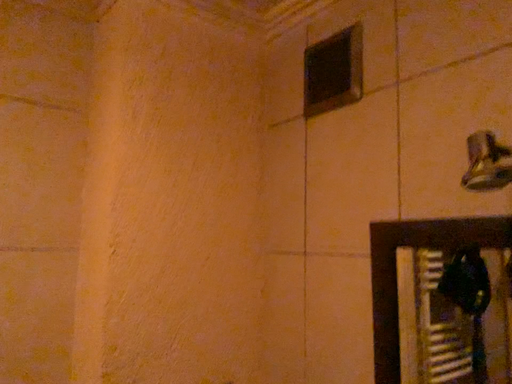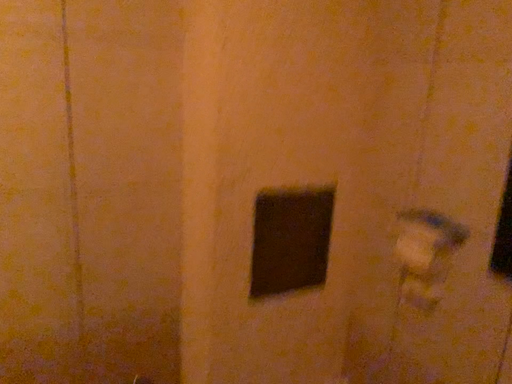
Question: How did the camera likely rotate when shooting the video?

Choices:
 (A) rotated downward
 (B) rotated upward

Answer: (A)